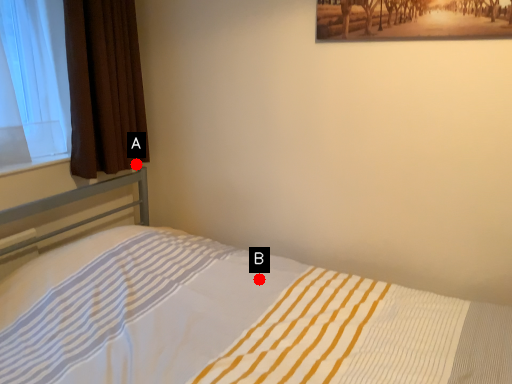
Question: Two points are circled on the image, labeled by A and B beside each circle. Which point appears farthest from the camera in this image?

Choices:
 (A) A is further
 (B) B is further

Answer: (A)